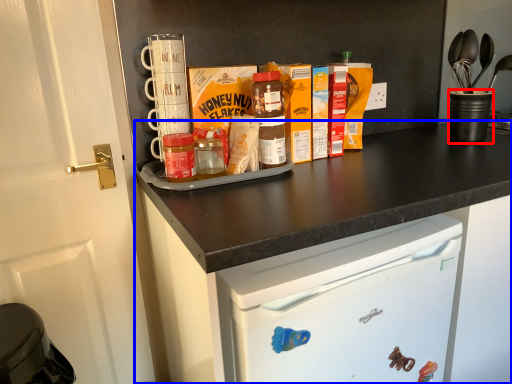
Question: Which of the following is the farthest to the observer, appliance (highlighted by a red box) or cabinetry (highlighted by a blue box)?

Choices:
 (A) appliance
 (B) cabinetry

Answer: (A)